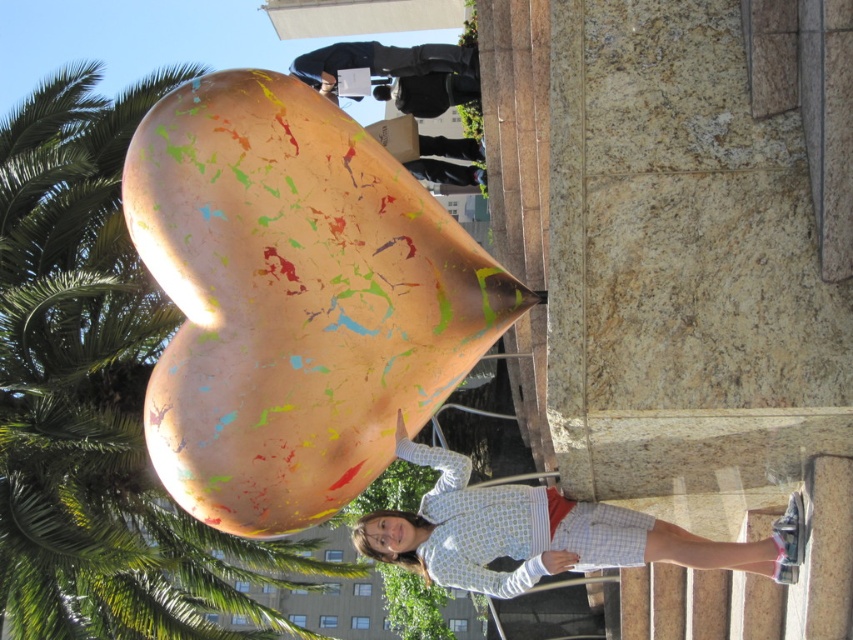
Which is more to the right, multicolored painted heart at center or light blue striped shirt at center?

From the viewer's perspective, light blue striped shirt at center appears more on the right side.

Describe the element at coordinates (294, 300) in the screenshot. I see `multicolored painted heart at center` at that location.

The height and width of the screenshot is (640, 853). What are the coordinates of `multicolored painted heart at center` in the screenshot? It's located at (294, 300).

Is green leafy palm tree at upper left below light blue striped shirt at center?

No, green leafy palm tree at upper left is not below light blue striped shirt at center.

Is green leafy palm tree at upper left wider than light blue striped shirt at center?

Correct, the width of green leafy palm tree at upper left exceeds that of light blue striped shirt at center.

Does point (61, 544) come in front of point (393, 544)?

No, it is not.

Image resolution: width=853 pixels, height=640 pixels. Identify the location of green leafy palm tree at upper left. (96, 396).

Is point (418, 253) positioned in front of point (113, 584)?

Yes, point (418, 253) is in front of point (113, 584).

Does point (277, 125) lie in front of point (10, 353)?

Yes, it is.

Where is `multicolored painted heart at center`? This screenshot has height=640, width=853. multicolored painted heart at center is located at coordinates (294, 300).